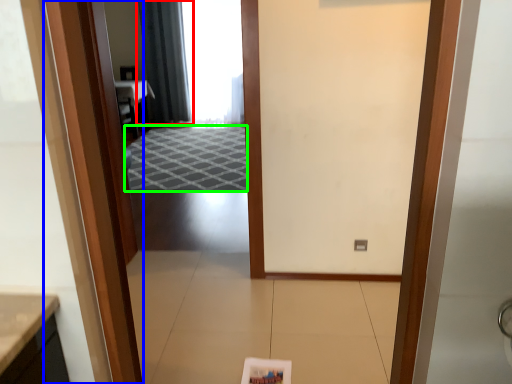
Question: Which object is the farthest from curtain (highlighted by a red box)? Choose among these: door (highlighted by a blue box) or doormat (highlighted by a green box).

Choices:
 (A) door
 (B) doormat

Answer: (A)